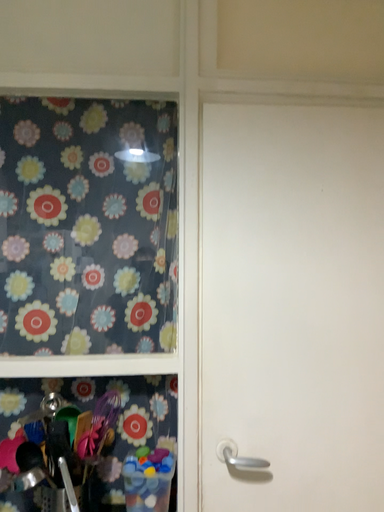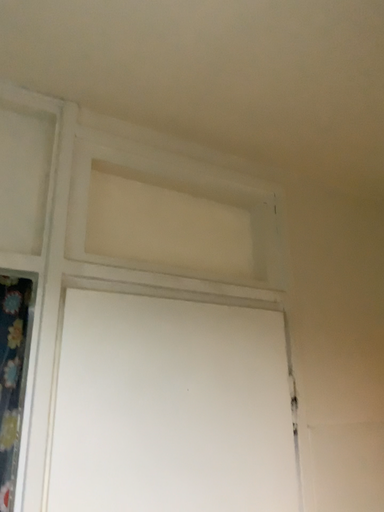
Question: Which way did the camera rotate in the video?

Choices:
 (A) rotated upward
 (B) rotated downward

Answer: (A)